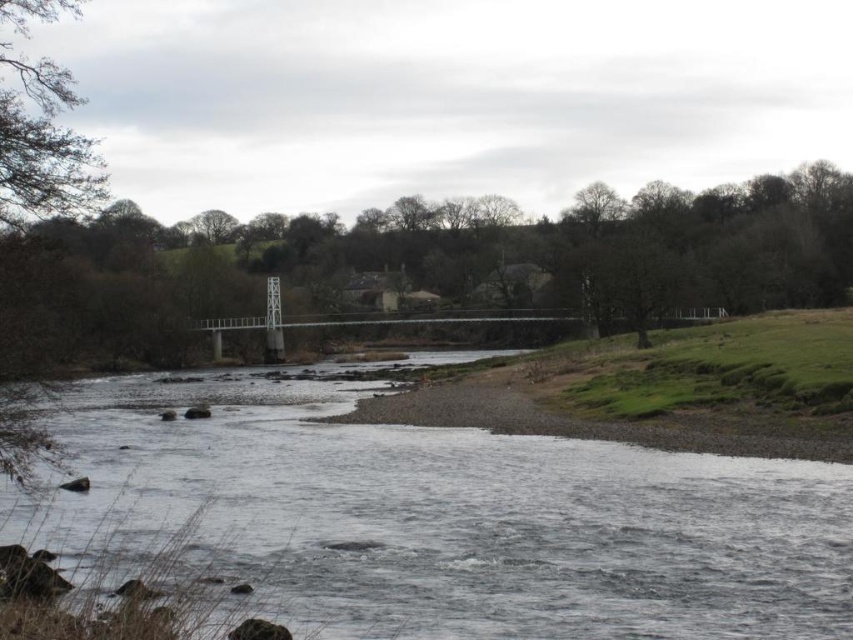
Which is more to the left, gray smooth river at center or brown textured tree at left?

brown textured tree at left is more to the left.

Looking at this image, is gray smooth river at center smaller than brown textured tree at left?

Yes, gray smooth river at center is smaller than brown textured tree at left.

Describe the element at coordinates (438, 522) in the screenshot. Image resolution: width=853 pixels, height=640 pixels. I see `gray smooth river at center` at that location.

Identify the location of gray smooth river at center. (438, 522).